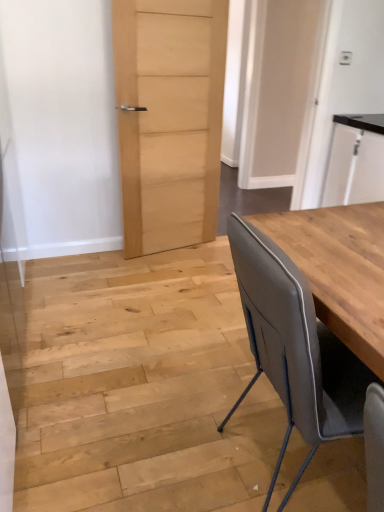
Question: Is point (215, 17) positioned closer to the camera than point (342, 202)?

Choices:
 (A) farther
 (B) closer

Answer: (B)

Question: Is natural wood door at center, which is counted as the second door, starting from the right, situated inside white glossy cabinet at upper right or outside?

Choices:
 (A) inside
 (B) outside

Answer: (B)

Question: Estimate the real-world distances between objects in this image. Which object is closer to the matte wood door at center, the 2th door positioned from the left?

Choices:
 (A) natural wood door at center, which is counted as the second door, starting from the right
 (B) white glossy cabinet at upper right
 (C) matte gray chair at right

Answer: (B)

Question: Which object is the farthest from the white glossy cabinet at upper right?

Choices:
 (A) natural wood door at center, the 1th door when ordered from left to right
 (B) matte gray chair at right
 (C) matte wood door at center, marked as the first door in a right-to-left arrangement

Answer: (B)